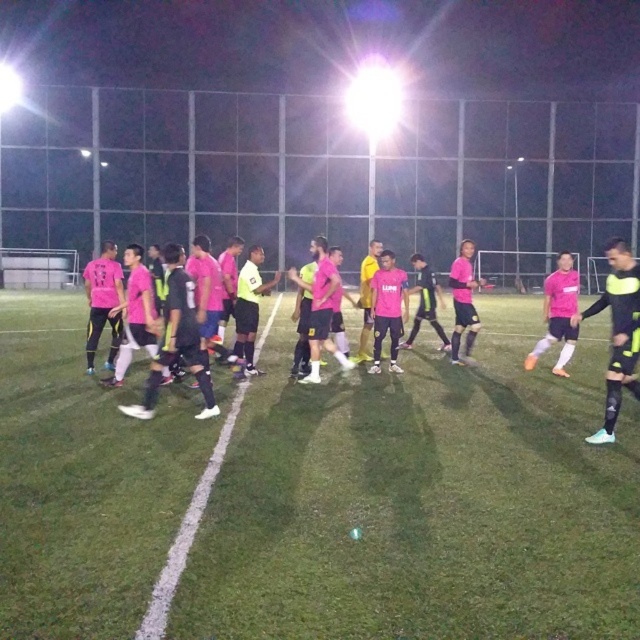
Does green grass football field at center have a greater height compared to pink matte jersey at left?

No.

Which is in front, point (17, 376) or point (620, 285)?

Positioned in front is point (620, 285).

At what (x,y) coordinates should I click in order to perform the action: click on green grass football field at center. Please return your answer as a coordinate pair (x, y). The width and height of the screenshot is (640, 640). Looking at the image, I should click on (420, 502).